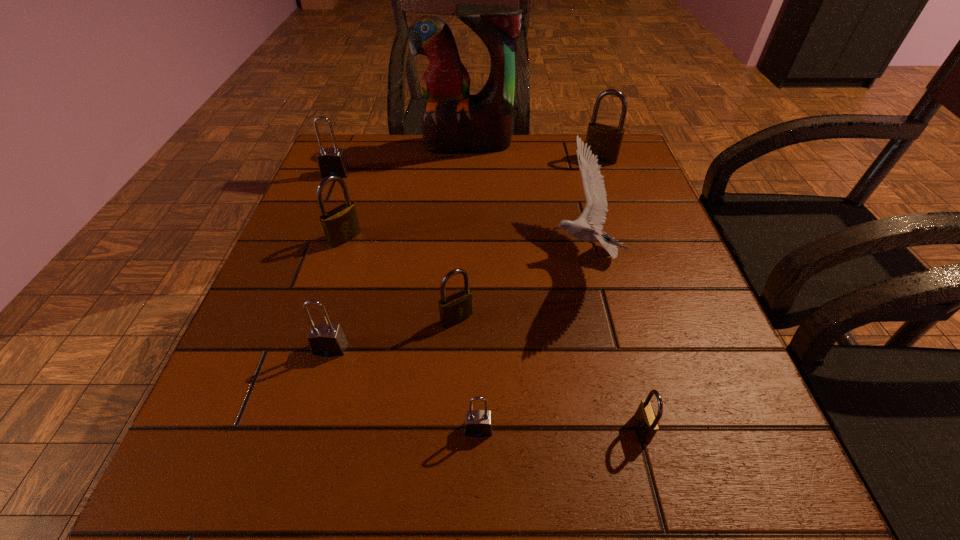
Locate an element on the screen. Image resolution: width=960 pixels, height=540 pixels. free spot located at the tip of the beak of the white gull is located at coordinates (514, 254).

Where is `free location located 0.250m on the shackle of the second farthest padlock`? The image size is (960, 540). free location located 0.250m on the shackle of the second farthest padlock is located at coordinates (305, 247).

You are a GUI agent. You are given a task and a screenshot of the screen. Output one action in this format:
    pyautogui.click(x=<x>, y=<y>)
    Task: Click on the vacant space located 0.350m on the right of the second farthest brass padlock
    
    Given the screenshot: What is the action you would take?
    pyautogui.click(x=526, y=238)

Image resolution: width=960 pixels, height=540 pixels. I want to click on vacant area located on the shackle of the second smallest gray padlock, so click(x=285, y=509).

Find the location of a particular element. The image size is (960, 540). free space located on the back of the third farthest brass padlock is located at coordinates (462, 207).

This screenshot has height=540, width=960. Identify the location of vacant space located on the shackle of the nearest gray padlock. (478, 482).

You are a GUI agent. You are given a task and a screenshot of the screen. Output one action in this format:
    pyautogui.click(x=<x>, y=<y>)
    Task: Click on the blank space located on the back of the second brass padlock from right to left
    The width and height of the screenshot is (960, 540).
    Given the screenshot: What is the action you would take?
    coord(619,342)

Identify the location of parrot that is positioned at the far edge. This screenshot has width=960, height=540. (453, 121).

Locate an element on the screen. The width and height of the screenshot is (960, 540). gull at the right edge is located at coordinates (594, 214).

Identify the location of object that is at the far left corner. (331, 161).